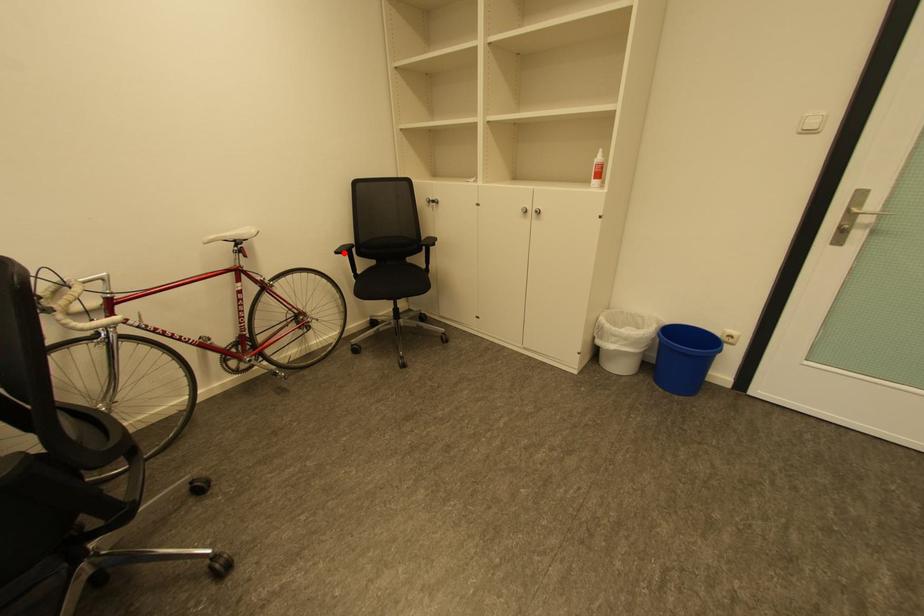
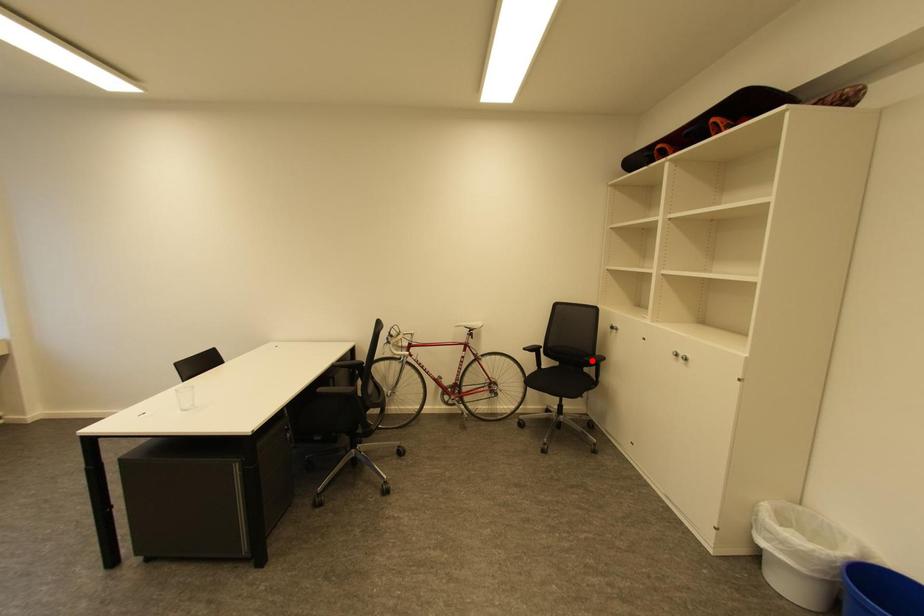
I am providing you with two images of the same scene from different viewpoints. A red point is marked on the first image and another point is marked on the second image. Is the marked point in image1 the same physical position as the marked point in image2?

No